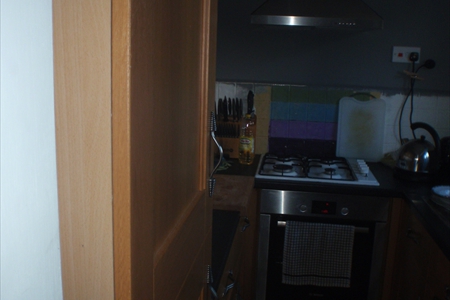
This screenshot has height=300, width=450. I want to click on white wall along left side of image, so click(x=25, y=159).